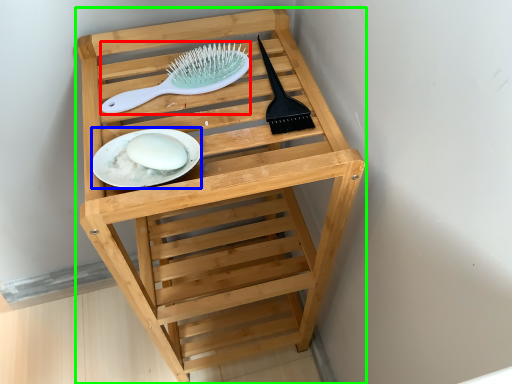
Question: Which is farther away from brush (highlighted by a red box)? plate (highlighted by a blue box) or furniture (highlighted by a green box)?

Choices:
 (A) plate
 (B) furniture

Answer: (B)